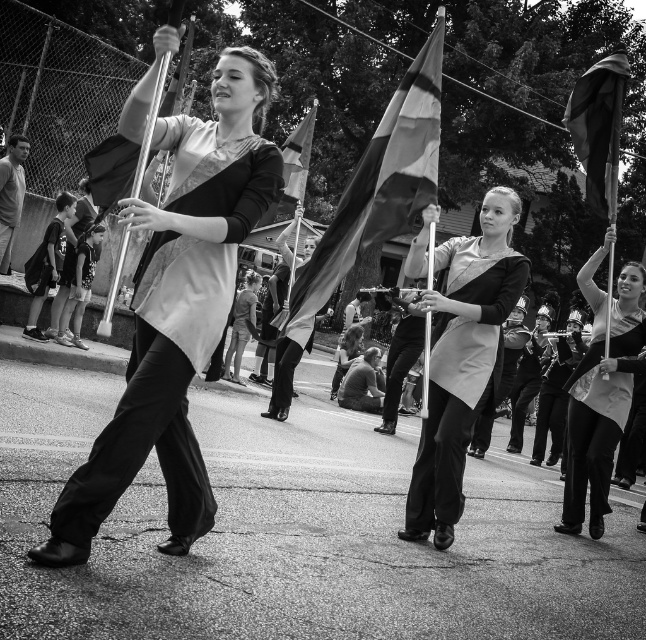
Question: Can you confirm if smooth fabric pants at center is positioned to the right of striped fabric flag at center?

Choices:
 (A) no
 (B) yes

Answer: (B)

Question: Which point is farther to the camera?

Choices:
 (A) smooth fabric pants at center
 (B) matte black flag at right

Answer: (A)

Question: Is matte black flag at left thinner than matte black jacket at center?

Choices:
 (A) no
 (B) yes

Answer: (A)

Question: Which object is closer to the camera taking this photo?

Choices:
 (A) smooth leather jacket at lower center
 (B) striped fabric flag at center

Answer: (B)

Question: Does matte black flag at right appear on the left side of silky fabric flag at upper right?

Choices:
 (A) no
 (B) yes

Answer: (A)

Question: Among these points, which one is nearest to the camera?

Choices:
 (A) (417, 524)
 (B) (1, 166)

Answer: (A)